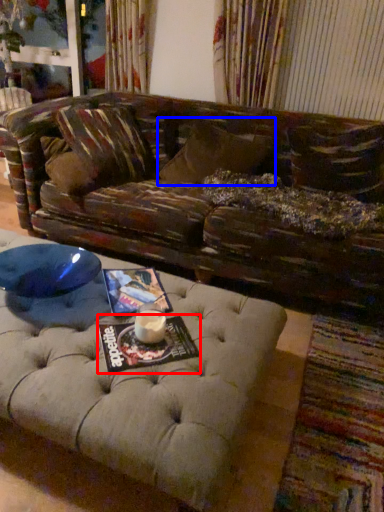
Question: Which of the following is the farthest to the observer, magazine (highlighted by a red box) or pillow (highlighted by a blue box)?

Choices:
 (A) magazine
 (B) pillow

Answer: (B)